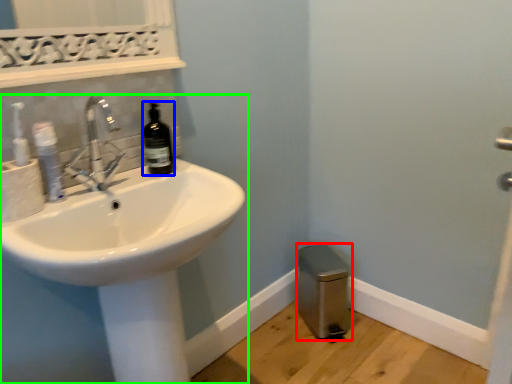
Question: Considering the real-world distances, which object is farthest from bidet (highlighted by a red box)? bottle (highlighted by a blue box) or sink (highlighted by a green box)?

Choices:
 (A) bottle
 (B) sink

Answer: (A)